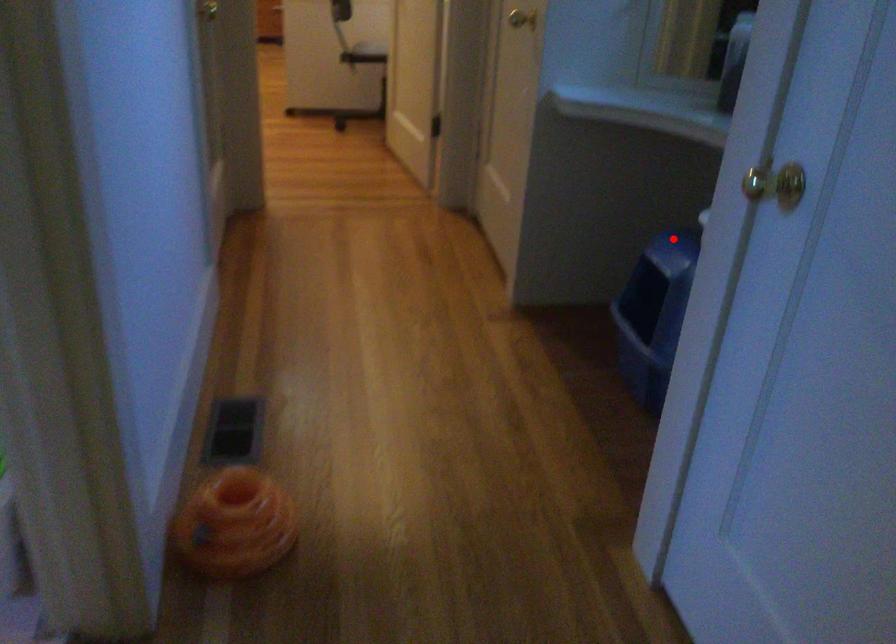
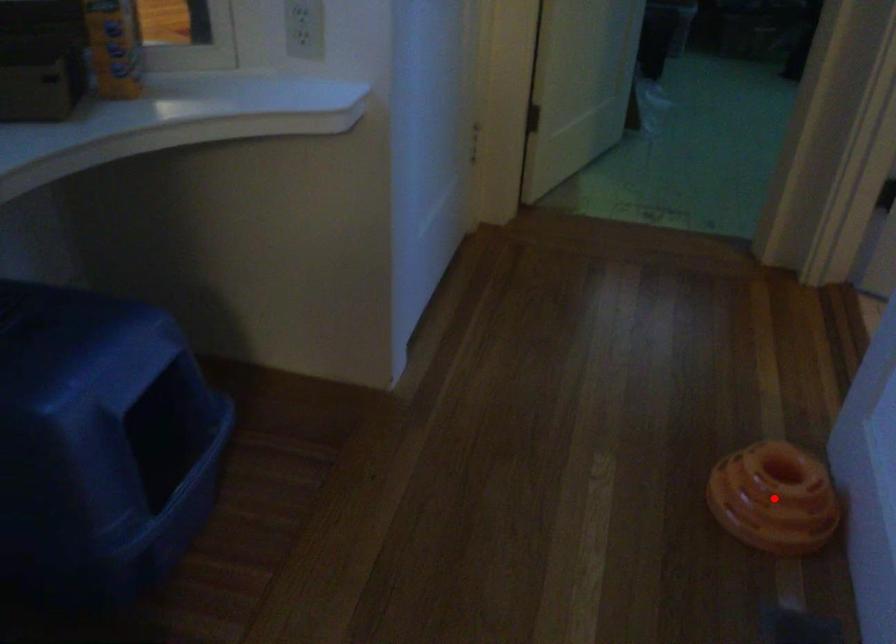
I am providing you with two images of the same scene from different viewpoints. A red point is marked on the first image and another point is marked on the second image. Does the point marked in image1 correspond to the same location as the one in image2?

No